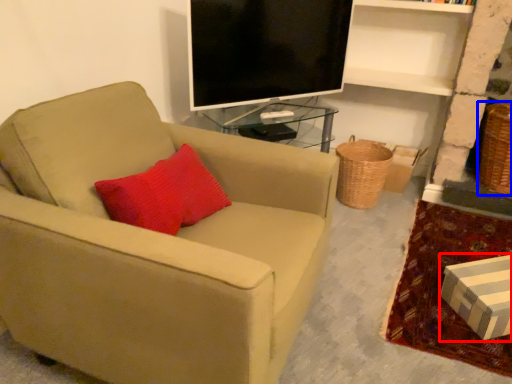
Question: Which point is closer to the camera, box (highlighted by a red box) or basket (highlighted by a blue box)?

Choices:
 (A) box
 (B) basket

Answer: (A)